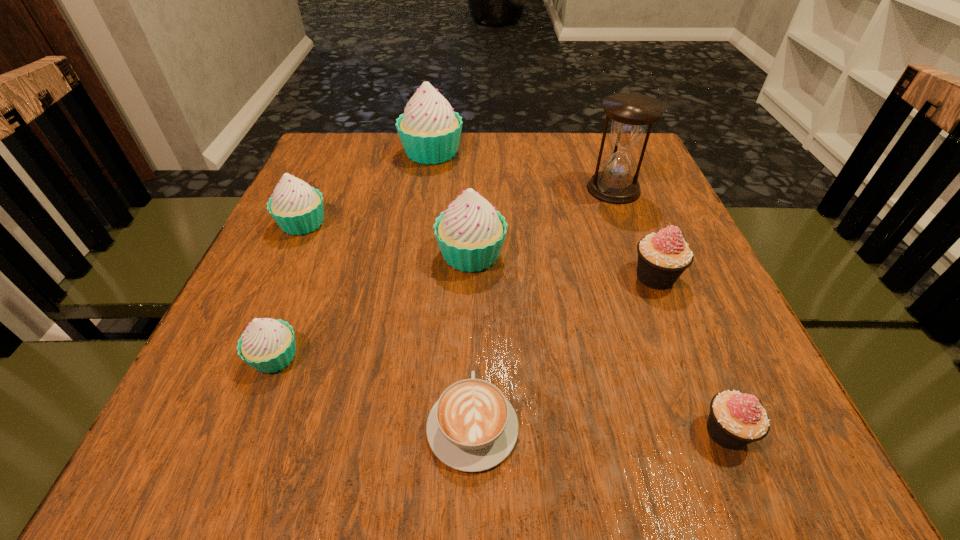
Identify the location of free point located on the side of the shortest object with the handle. This screenshot has width=960, height=540. (475, 231).

Identify the location of vacant region located on the side of the shortest object with the handle. This screenshot has height=540, width=960. (474, 265).

The width and height of the screenshot is (960, 540). I want to click on hourglass situated at the far edge, so click(631, 113).

I want to click on cupcake present at the far edge, so click(430, 130).

Locate an element on the screen. This screenshot has width=960, height=540. cupcake that is at the near edge is located at coordinates (736, 419).

At what (x,y) coordinates should I click in order to perform the action: click on cappuccino located in the near edge section of the desktop. Please return your answer as a coordinate pair (x, y). Looking at the image, I should click on (472, 427).

This screenshot has height=540, width=960. Find the location of `hourglass at the right edge`. hourglass at the right edge is located at coordinates (631, 113).

At what (x,y) coordinates should I click in order to perform the action: click on object positioned at the far right corner. Please return your answer as a coordinate pair (x, y). This screenshot has width=960, height=540. Looking at the image, I should click on (631, 113).

What are the coordinates of `object present at the near right corner` in the screenshot? It's located at (736, 419).

Where is `vacant space at the far edge of the desktop`? The image size is (960, 540). vacant space at the far edge of the desktop is located at coordinates [510, 163].